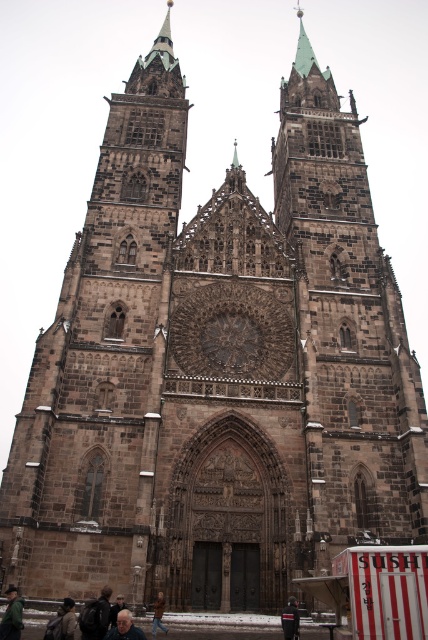
What do you see at coordinates (11, 616) in the screenshot? I see `green woolen jacket at lower left` at bounding box center [11, 616].

Between green woolen jacket at lower left and gray hair at lower center, which one appears on the right side from the viewer's perspective?

From the viewer's perspective, gray hair at lower center appears more on the right side.

Which is behind, point (12, 588) or point (133, 637)?

The point (12, 588) is more distant.

Find the location of a particular element. green woolen jacket at lower left is located at coordinates (11, 616).

Who is more distant from viewer, (8, 632) or (157, 620)?

Point (157, 620)

Which is more to the right, green woolen jacket at lower left or brown leather jacket at lower center?

brown leather jacket at lower center

Is point (3, 632) farther from camera compared to point (157, 621)?

No, it is in front of (157, 621).

Image resolution: width=428 pixels, height=640 pixels. Find the location of `green woolen jacket at lower left`. green woolen jacket at lower left is located at coordinates (11, 616).

Which is below, brown leather jacket at lower center or dark brown leather jacket at lower center?

brown leather jacket at lower center is below.

Who is more distant from viewer, (160, 598) or (115, 596)?

Point (115, 596)

You are a GUI agent. You are given a task and a screenshot of the screen. Output one action in this format:
    pyautogui.click(x=<x>, y=<y>)
    Task: Click on the brown leather jacket at lower center
    
    Given the screenshot: What is the action you would take?
    pyautogui.click(x=158, y=612)